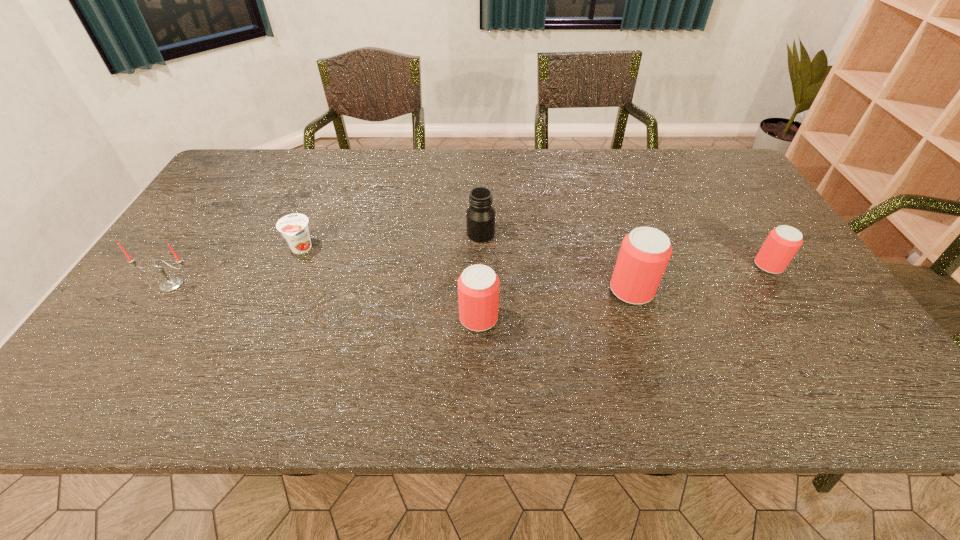
The width and height of the screenshot is (960, 540). I want to click on the leftmost beer can, so click(478, 286).

You are a GUI agent. You are given a task and a screenshot of the screen. Output one action in this format:
    pyautogui.click(x=<x>, y=<y>)
    Task: Click on the second beer can from right to left
    The width and height of the screenshot is (960, 540).
    Given the screenshot: What is the action you would take?
    pyautogui.click(x=645, y=252)

Locate an element on the screen. the tallest object is located at coordinates (645, 252).

Identify the location of the fifth tallest object. (782, 243).

You are a GUI agent. You are given a task and a screenshot of the screen. Output one action in this format:
    pyautogui.click(x=<x>, y=<y>)
    Task: Click on the rightmost beer can
    This screenshot has height=540, width=960.
    Given the screenshot: What is the action you would take?
    pyautogui.click(x=782, y=243)

Locate an element on the screen. Image resolution: width=960 pixels, height=540 pixels. jar is located at coordinates (480, 216).

Identify the location of yogurt. (294, 227).

Find the location of a particular element. the second object from left to right is located at coordinates (294, 227).

Locate an element on the screen. the leftmost object is located at coordinates point(172,283).

Image resolution: width=960 pixels, height=540 pixels. In order to click on free location located on the back of the leftmost beer can in this screenshot , I will do `click(479, 226)`.